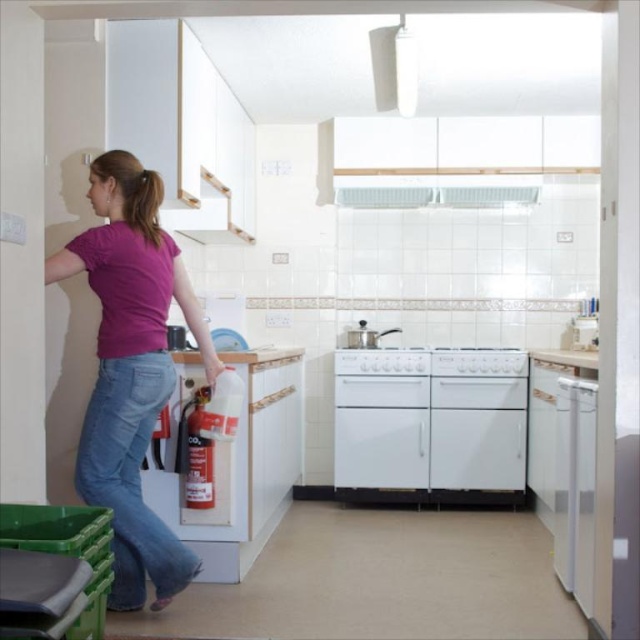
You are standing in the kitchen and see two points marked in the scene. Which point is closer to you, point (410, 454) or point (564, 538)?

Point (564, 538) is closer to you because the description states that point (410, 454) is further to the camera than point (564, 538).

You are standing in the kitchen and see two points marked in the scene. The first point is at coordinates point (115,374) and the second is at point (557,465). Which point is closer to you?

Point (115,374) is in front of point (557,465), so it is closer to you.